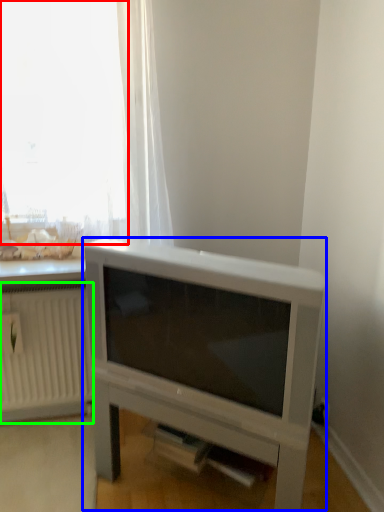
Question: Estimate the real-world distances between objects in this image. Which object is farther from window (highlighted by a red box), entertainment center (highlighted by a blue box) or radiator (highlighted by a green box)?

Choices:
 (A) entertainment center
 (B) radiator

Answer: (B)